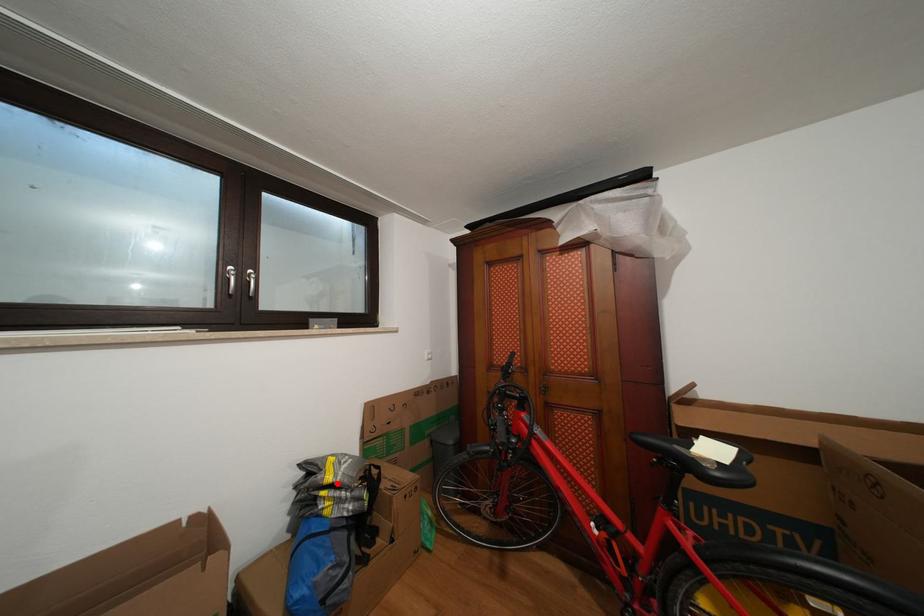
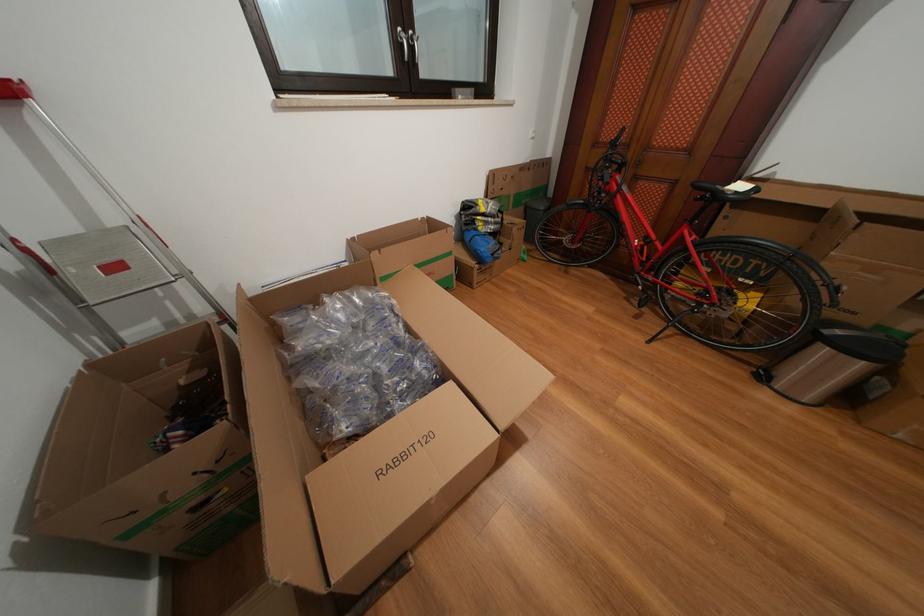
Question: I am providing you with two images of the same scene from different viewpoints. Given a red point in image1, look at the same physical point in image2. Is it:

Choices:
 (A) Closer to the viewpoint
 (B) Farther from the viewpoint

Answer: (A)